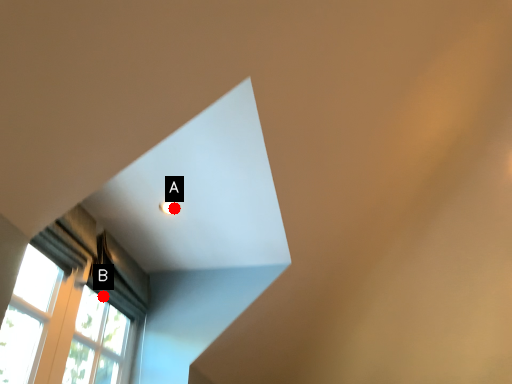
Question: Two points are circled on the image, labeled by A and B beside each circle. Which point is closer to the camera?

Choices:
 (A) A is closer
 (B) B is closer

Answer: (A)